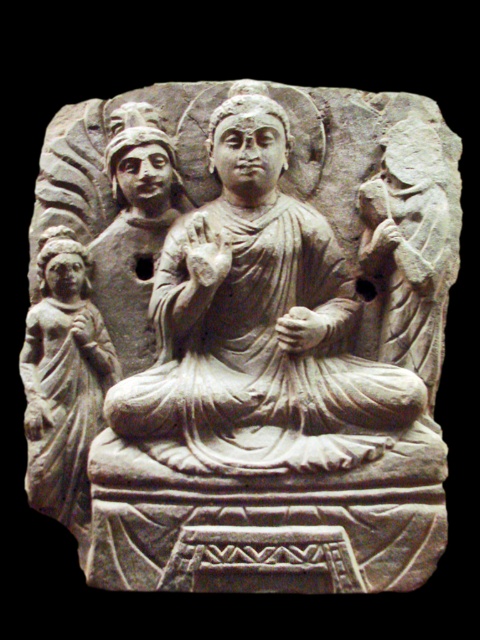
Question: Does smooth stone figure at center appear over smooth stone figure at upper left?

Choices:
 (A) no
 (B) yes

Answer: (A)

Question: Is smooth stone figure at center bigger than smooth beige statue at lower left?

Choices:
 (A) no
 (B) yes

Answer: (A)

Question: Among these points, which one is farthest from the camera?

Choices:
 (A) (440, 276)
 (B) (22, 365)

Answer: (B)

Question: Among these objects, which one is nearest to the camera?

Choices:
 (A) smooth beige statue at lower left
 (B) smooth stone figure at center
 (C) smooth stone figure at upper left

Answer: (A)

Question: Is smooth beige statue at lower left to the left of smooth stone figure at upper left from the viewer's perspective?

Choices:
 (A) no
 (B) yes

Answer: (B)

Question: Which point is closer to the camera?

Choices:
 (A) tap(52, 337)
 (B) tap(423, 172)

Answer: (A)